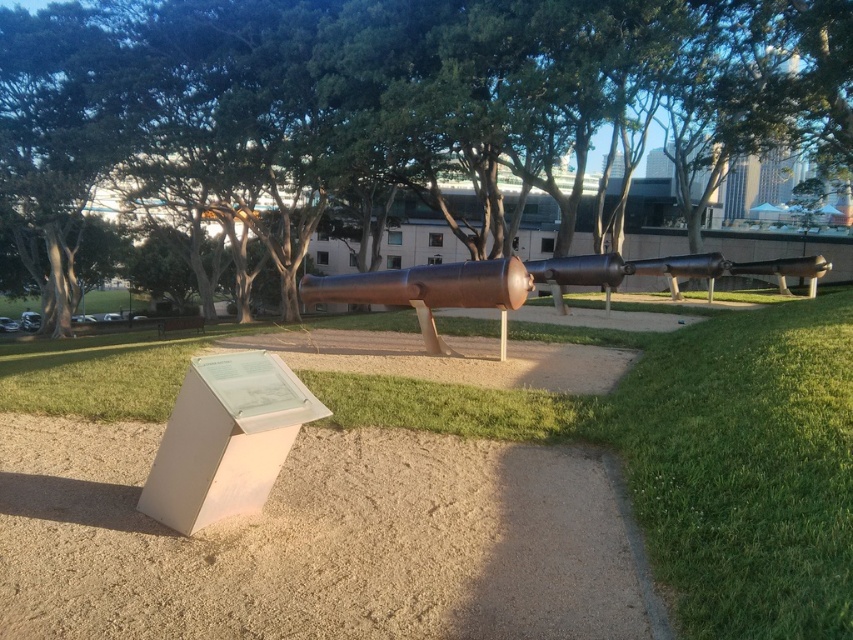
Question: Can you confirm if green grass at center is bigger than bronze cannon at center?

Choices:
 (A) yes
 (B) no

Answer: (B)

Question: Is green grass at center smaller than bronze cannon at center?

Choices:
 (A) no
 (B) yes

Answer: (B)

Question: Which of the following is the closest to the observer?

Choices:
 (A) (689, 132)
 (B) (508, 260)
 (C) (740, 314)

Answer: (B)

Question: Is green grass at center positioned before bronze cannon at center?

Choices:
 (A) yes
 (B) no

Answer: (A)

Question: Estimate the real-world distances between objects in this image. Which object is farther from the green grass at center?

Choices:
 (A) bronze cannon at center
 (B) green leafy tree at center

Answer: (B)

Question: Among these points, which one is nearest to the camera?

Choices:
 (A) (846, 86)
 (B) (668, 557)
 (C) (804, 268)

Answer: (B)